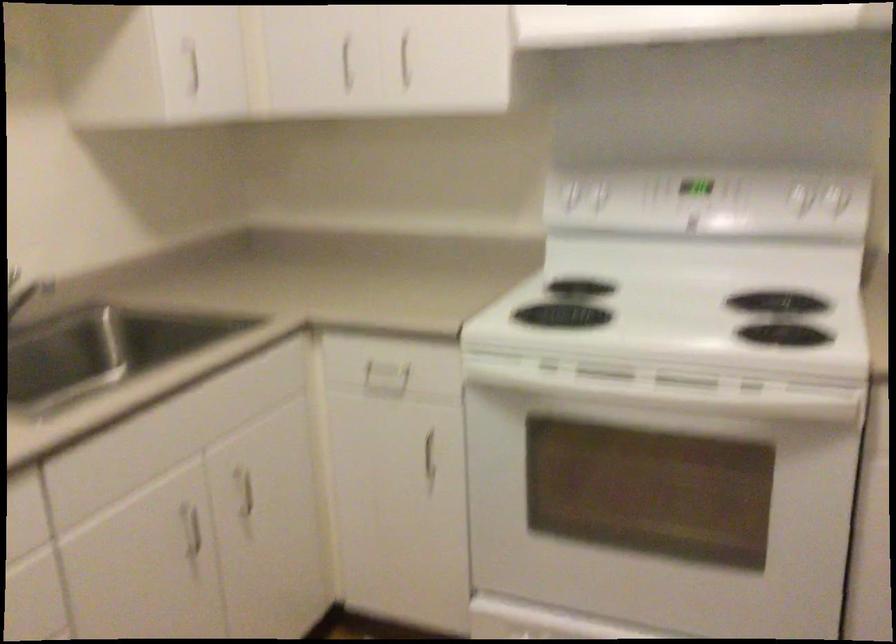
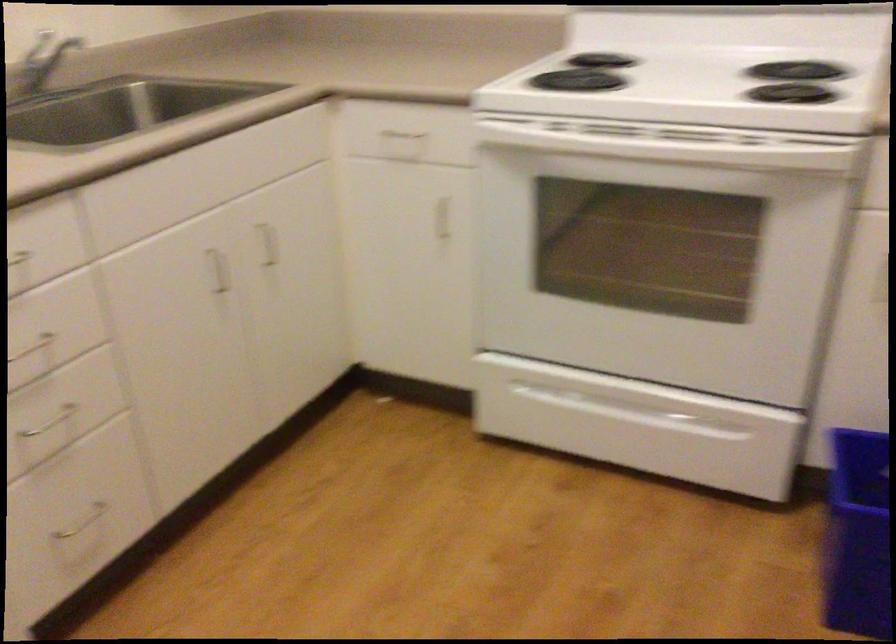
Question: The first image is from the beginning of the video and the second image is from the end. How did the camera likely rotate when shooting the video?

Choices:
 (A) Left
 (B) Right
 (C) Up
 (D) Down

Answer: (D)